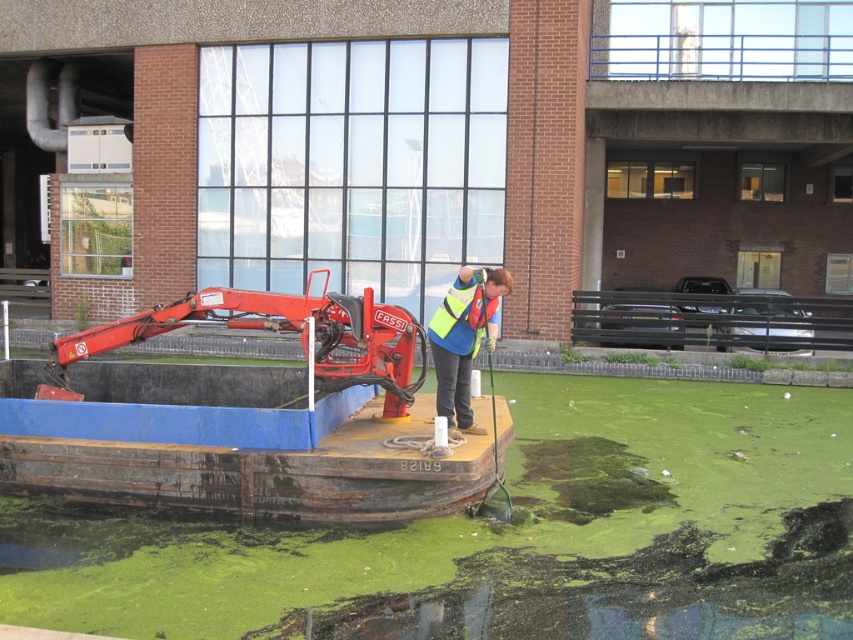
Question: Which point appears farthest from the camera in this image?

Choices:
 (A) (296, 300)
 (B) (485, 296)

Answer: (A)

Question: Does green algae at center appear on the right side of high visibility fabric safety vest at center?

Choices:
 (A) no
 (B) yes

Answer: (B)

Question: Does green algae at center appear over red metal crane at center?

Choices:
 (A) yes
 (B) no

Answer: (B)

Question: Among these points, which one is farthest from the camera?

Choices:
 (A) (302, 307)
 (B) (466, 346)
 (C) (97, 602)

Answer: (B)

Question: Is red metal crane at center below reflective yellow vest at center?

Choices:
 (A) no
 (B) yes

Answer: (B)

Question: Which is farther from the green algae at center?

Choices:
 (A) reflective yellow vest at center
 (B) red metal crane at center
 (C) high visibility fabric safety vest at center

Answer: (C)